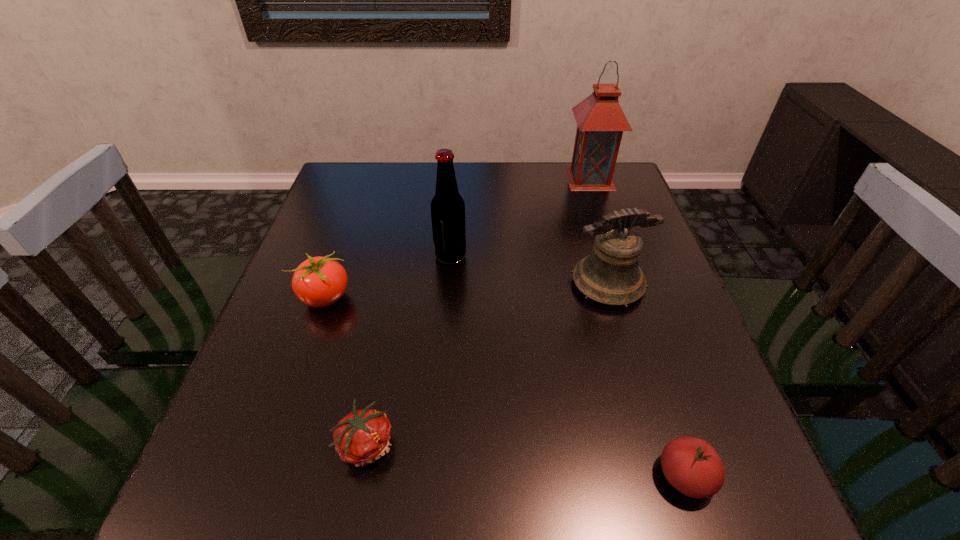
Identify the location of free point between the leftmost tomato and the second tomato from right to left. This screenshot has width=960, height=540. (346, 370).

You are a GUI agent. You are given a task and a screenshot of the screen. Output one action in this format:
    pyautogui.click(x=<x>, y=<y>)
    Task: Click on the unoccupied area between the second object from left to right and the rightmost tomato
    This screenshot has height=540, width=960.
    Given the screenshot: What is the action you would take?
    pyautogui.click(x=526, y=460)

Where is `unoccupied area between the rightmost tomato and the second tallest object`? unoccupied area between the rightmost tomato and the second tallest object is located at coordinates (567, 366).

Locate an element on the screen. The width and height of the screenshot is (960, 540). vacant area between the farthest object and the second tomato from left to right is located at coordinates (478, 311).

Find the location of a particular element. This screenshot has width=960, height=540. free point between the rightmost tomato and the second tallest object is located at coordinates (567, 366).

Identify which object is the closest to the fourth object from right to left. Please provide its 2D coordinates. Your answer should be formatted as a tuple, i.e. [(x, y)], where the tuple contains the x and y coordinates of a point satisfying the conditions above.

[(319, 281)]

Identify which object is the second nearest to the leftmost tomato. Please provide its 2D coordinates. Your answer should be formatted as a tuple, i.e. [(x, y)], where the tuple contains the x and y coordinates of a point satisfying the conditions above.

[(362, 437)]

Locate which tomato ranks in proximity to the leftmost object. Please provide its 2D coordinates. Your answer should be formatted as a tuple, i.e. [(x, y)], where the tuple contains the x and y coordinates of a point satisfying the conditions above.

[(362, 437)]

This screenshot has width=960, height=540. In order to click on tomato that is the third closest to the fourth object from right to left in this screenshot , I will do `click(691, 465)`.

Identify the location of free space that satisfies the following two spatial constraints: 1. on the front side of the fourth shortest object; 2. on the left side of the rightmost tomato. The image size is (960, 540). click(x=664, y=476).